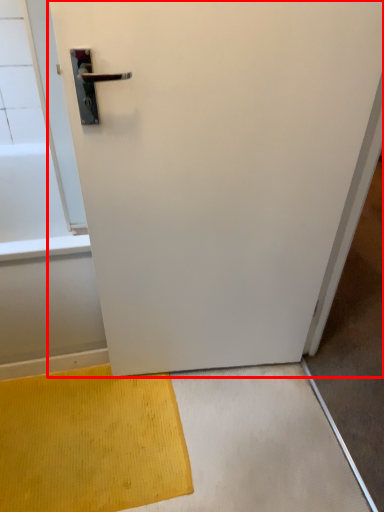
Question: From the image's perspective, where is door (annotated by the red box) located in relation to doormat in the image?

Choices:
 (A) above
 (B) below

Answer: (A)